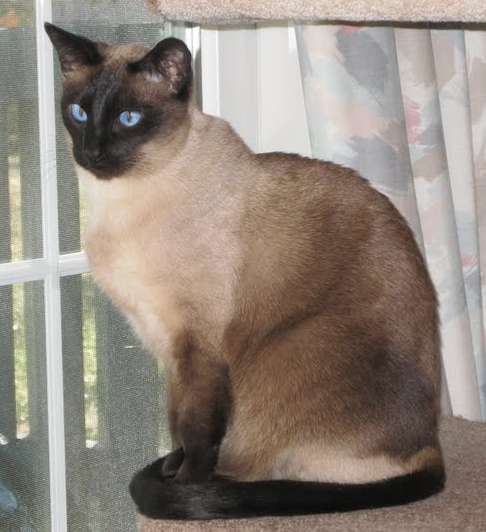
Identify the location of window. The image size is (486, 532). (99, 384).